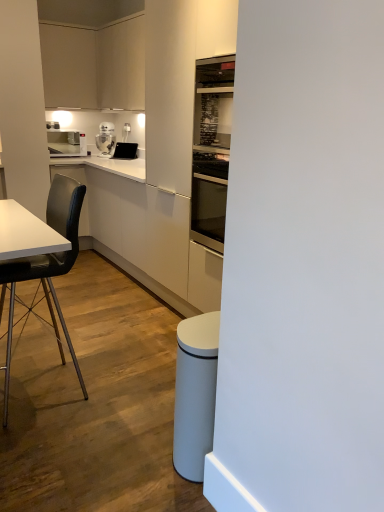
This screenshot has height=512, width=384. I want to click on free area below black matte chair at left (from a real-world perspective), so click(x=53, y=384).